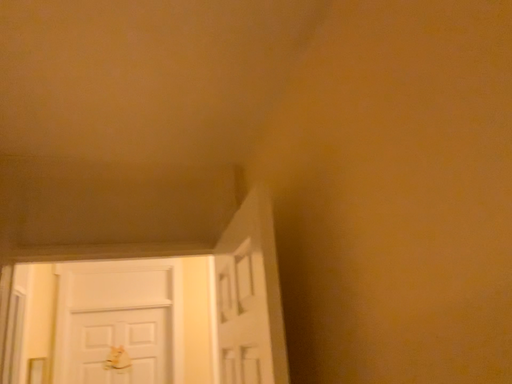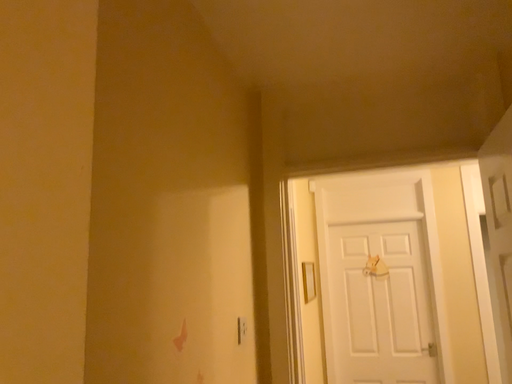
Question: Which way did the camera rotate in the video?

Choices:
 (A) rotated upward
 (B) rotated downward

Answer: (B)